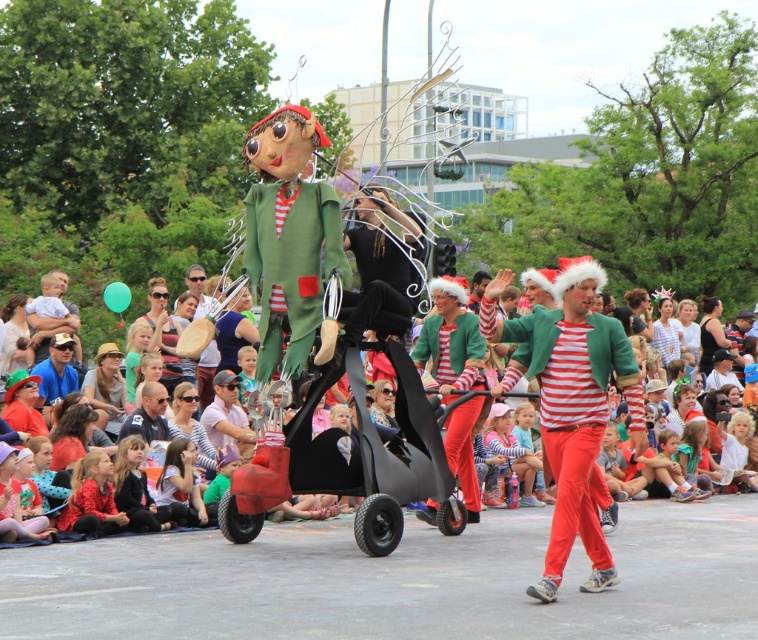
In the scene shown: Can you confirm if black matte monocycle at center is smaller than brushed metal drum at center?

Correct, black matte monocycle at center occupies less space than brushed metal drum at center.

Is point (356, 486) positioned after point (193, 285)?

No, it is in front of (193, 285).

Between point (237, 484) and point (199, 300), which one is positioned behind?

Point (199, 300)

At what (x,y) coordinates should I click in order to perform the action: click on black matte monocycle at center. Please return your answer as a coordinate pair (x, y). This screenshot has height=640, width=758. Looking at the image, I should click on (349, 461).

This screenshot has height=640, width=758. What are the coordinates of `striped cotton shirt at center` in the screenshot? It's located at (569, 404).

Looking at this image, does striped cotton shirt at center appear over black matte monocycle at center?

Correct, striped cotton shirt at center is located above black matte monocycle at center.

Image resolution: width=758 pixels, height=640 pixels. What do you see at coordinates (569, 404) in the screenshot?
I see `striped cotton shirt at center` at bounding box center [569, 404].

Find the location of a particular element. striped cotton shirt at center is located at coordinates tap(569, 404).

Is striped cotton shirt at center to the left of matte red pants at center from the viewer's perspective?

In fact, striped cotton shirt at center is to the right of matte red pants at center.

What do you see at coordinates (569, 404) in the screenshot? Image resolution: width=758 pixels, height=640 pixels. I see `striped cotton shirt at center` at bounding box center [569, 404].

Where is `striped cotton shirt at center`? striped cotton shirt at center is located at coordinates (569, 404).